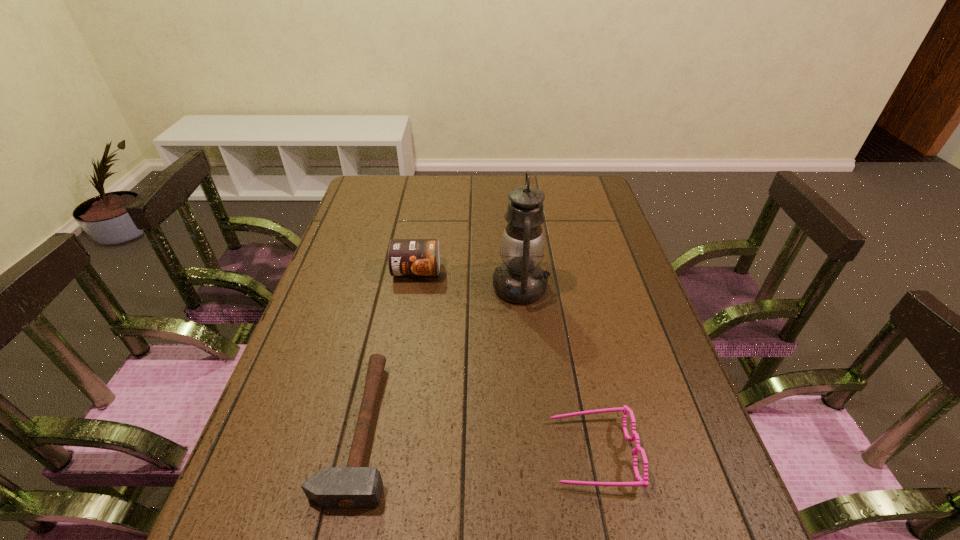
Image resolution: width=960 pixels, height=540 pixels. What are the coordinates of `free point between the hammer and the third tallest object` in the screenshot? It's located at (476, 441).

Locate an element on the screen. This screenshot has height=540, width=960. vacant region between the tallest object and the shortest object is located at coordinates (441, 358).

The height and width of the screenshot is (540, 960). I want to click on vacant point located between the tallest object and the hammer, so click(441, 358).

Locate an element on the screen. The image size is (960, 540). unoccupied area between the can and the hammer is located at coordinates (389, 350).

Locate an element on the screen. Image resolution: width=960 pixels, height=540 pixels. empty space between the second tallest object and the tallest object is located at coordinates (468, 279).

The width and height of the screenshot is (960, 540). What are the coordinates of `empty space between the tallest object and the second tallest object` in the screenshot? It's located at (468, 279).

Locate an element on the screen. free space between the hammer and the second tallest object is located at coordinates (389, 350).

Locate an element on the screen. the closest object to the second tallest object is located at coordinates (520, 279).

I want to click on the closest object relative to the spectacles, so click(x=520, y=279).

Identify the location of free spot that satisfies the following two spatial constraints: 1. on the front label of the oil lamp; 2. on the left side of the second tallest object. (414, 287).